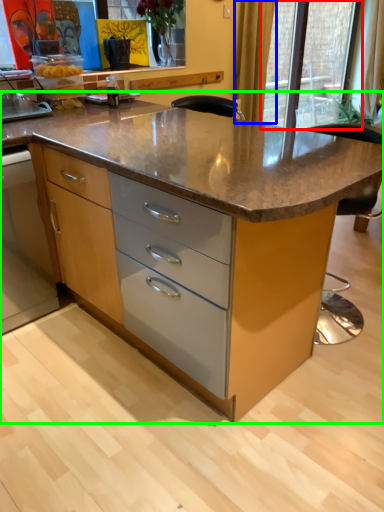
Question: Which object is positioned farthest from glass door (highlighted by a red box)? Select from curtain (highlighted by a blue box) and table (highlighted by a green box).

Choices:
 (A) curtain
 (B) table

Answer: (B)